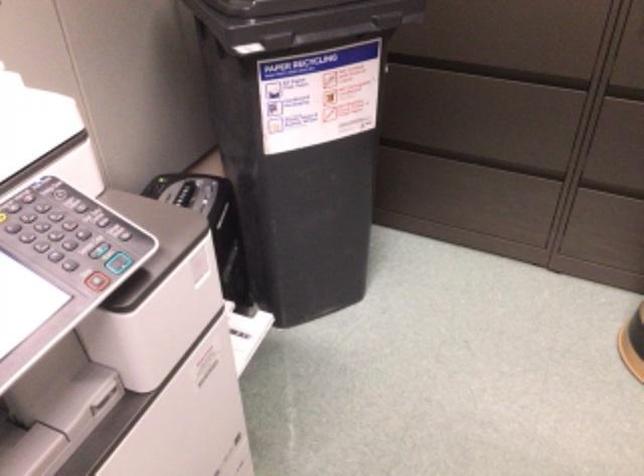
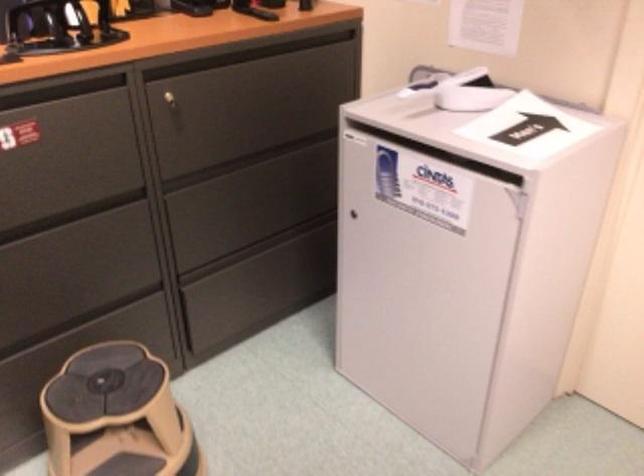
Question: The camera is either moving clockwise (left) or counter-clockwise (right) around the object. The first image is from the beginning of the video and the second image is from the end. Is the camera moving left or right when shooting the video?

Choices:
 (A) Left
 (B) Right

Answer: (A)